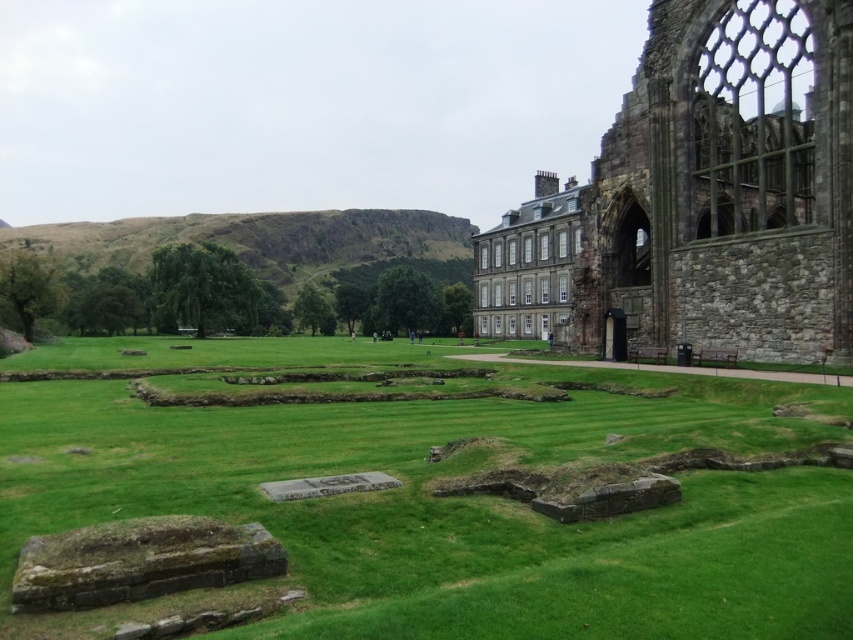
Question: Which point is farther from the camera taking this photo?

Choices:
 (A) (700, 310)
 (B) (503, 428)

Answer: (A)

Question: Which point is farther from the camera taking this photo?

Choices:
 (A) (665, 76)
 (B) (612, 621)

Answer: (A)

Question: Is the position of green grass at center less distant than that of stone wall at right?

Choices:
 (A) yes
 (B) no

Answer: (A)

Question: In this image, where is green grass at center located relative to stone wall at right?

Choices:
 (A) above
 (B) below

Answer: (B)

Question: Can you confirm if green grass at center is positioned to the left of stone wall at right?

Choices:
 (A) yes
 (B) no

Answer: (A)